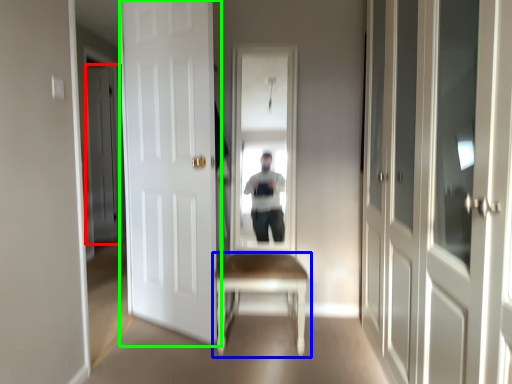
Question: Based on their relative distances, which object is nearer to door (highlighted by a red box)? Choose from table (highlighted by a blue box) and door (highlighted by a green box).

Choices:
 (A) table
 (B) door

Answer: (B)